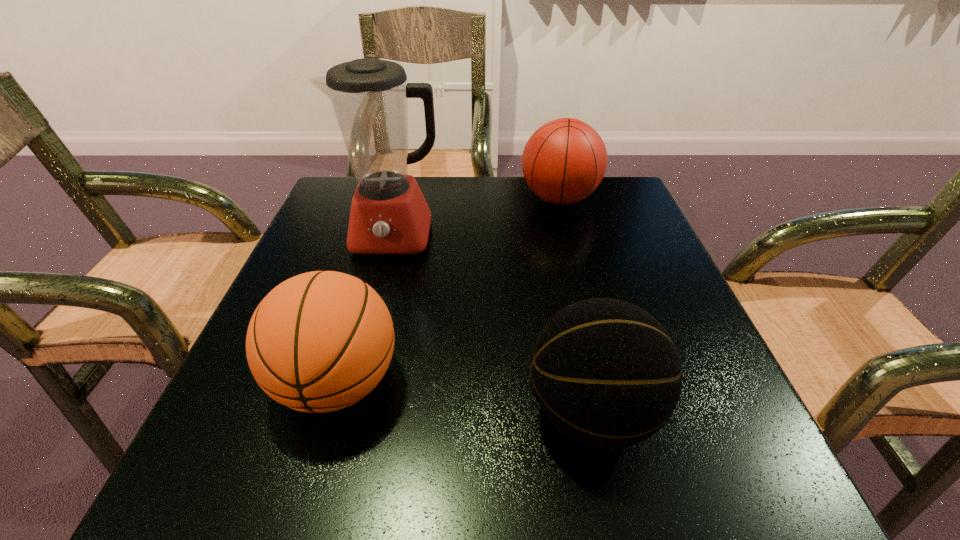
I want to click on free space at the near right corner, so click(x=680, y=474).

What are the coordinates of `vacant point located between the farthest basketball and the tallest object` in the screenshot? It's located at (476, 218).

At what (x,y) coordinates should I click in order to perform the action: click on vacant area that lies between the farthest basketball and the leftmost basketball. Please return your answer as a coordinate pair (x, y). Image resolution: width=960 pixels, height=540 pixels. Looking at the image, I should click on (448, 291).

The image size is (960, 540). I want to click on free spot between the leftmost basketball and the farthest basketball, so [x=448, y=291].

Identify which object is located as the third nearest to the farthest basketball. Please provide its 2D coordinates. Your answer should be formatted as a tuple, i.e. [(x, y)], where the tuple contains the x and y coordinates of a point satisfying the conditions above.

[(320, 341)]

The image size is (960, 540). Identify the location of object identified as the second closest to the blender. (320, 341).

Point out which basketball is positioned as the nearest to the blender. Please provide its 2D coordinates. Your answer should be formatted as a tuple, i.e. [(x, y)], where the tuple contains the x and y coordinates of a point satisfying the conditions above.

[(564, 161)]

Locate an element on the screen. The height and width of the screenshot is (540, 960). the closest basketball to the farthest basketball is located at coordinates (606, 373).

Locate an element on the screen. free location that satisfies the following two spatial constraints: 1. on the back side of the leftmost basketball; 2. on the right side of the farthest basketball is located at coordinates (391, 199).